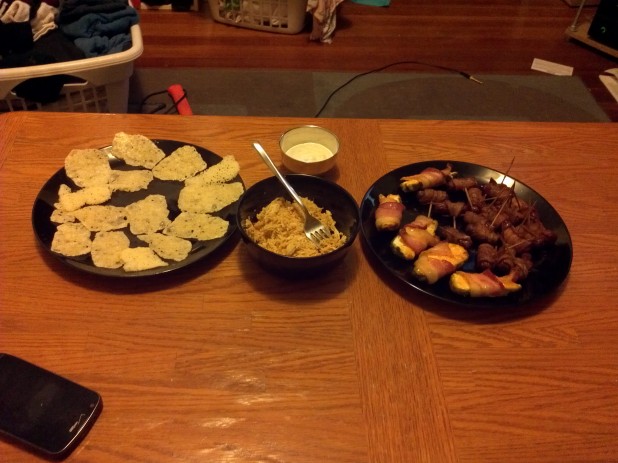
Find the location of a particular element. carpet on the hardwood floor is located at coordinates (290, 84), (410, 94).